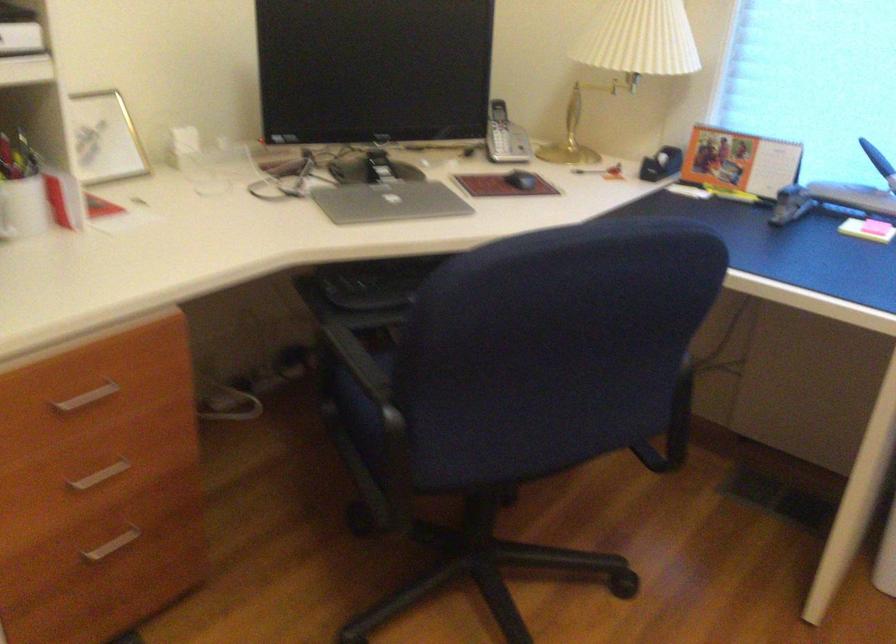
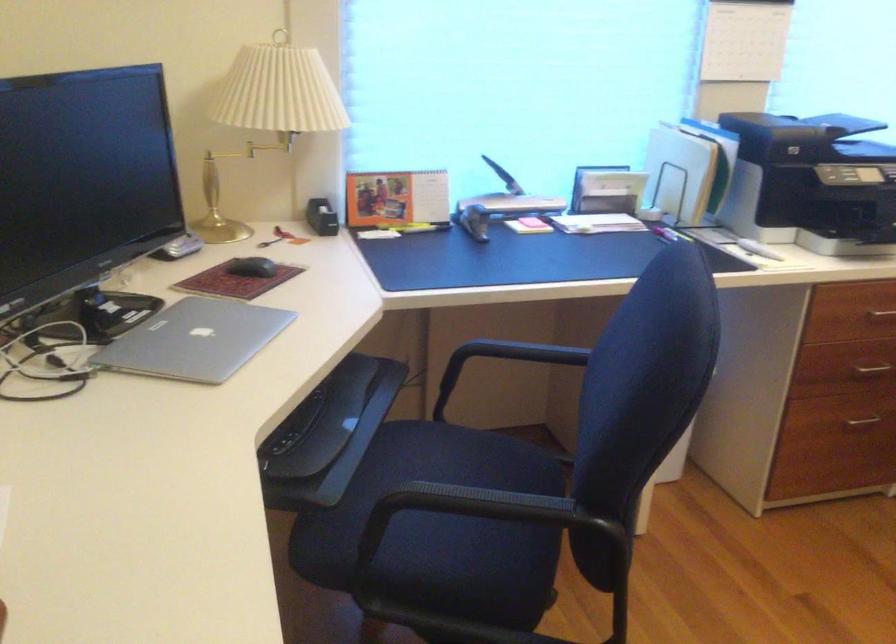
The point at (355, 361) is marked in the first image. Where is the corresponding point in the second image?

(458, 511)